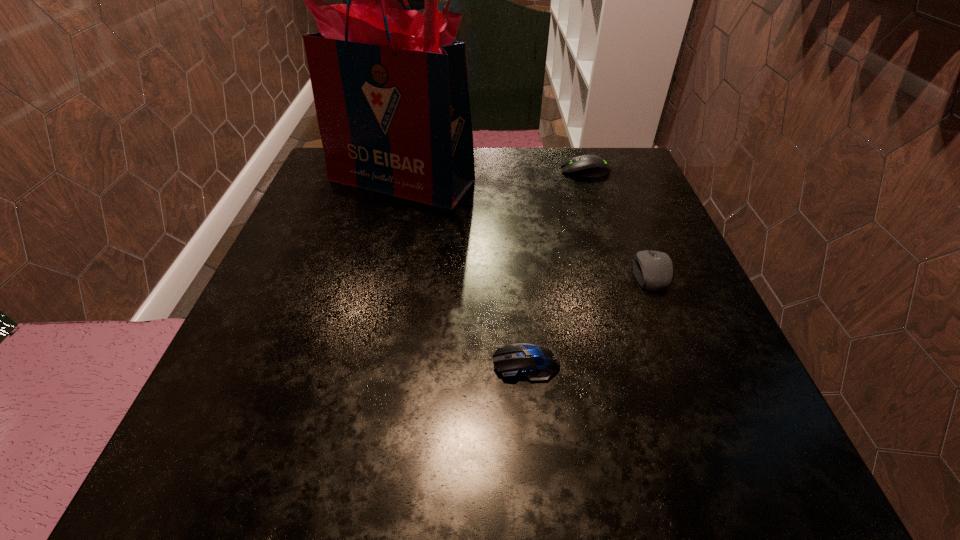
The height and width of the screenshot is (540, 960). In the image, there is a desktop. Identify the location of vacant space at the near edge. (518, 457).

The height and width of the screenshot is (540, 960). What are the coordinates of `vacant area at the left edge of the desktop` in the screenshot? It's located at (310, 362).

You are a GUI agent. You are given a task and a screenshot of the screen. Output one action in this format:
    pyautogui.click(x=<x>, y=<y>)
    Task: Click on the vacant space at the right edge of the desktop
    
    Given the screenshot: What is the action you would take?
    pyautogui.click(x=608, y=253)

Where is `free space at the far left corner of the desktop`? Image resolution: width=960 pixels, height=540 pixels. free space at the far left corner of the desktop is located at coordinates (327, 193).

Image resolution: width=960 pixels, height=540 pixels. I want to click on free space at the near right corner of the desktop, so click(712, 488).

You are a GUI agent. You are given a task and a screenshot of the screen. Output one action in this format:
    pyautogui.click(x=<x>, y=<y>)
    Task: Click on the blank region between the farthest computer mouse and the nearest object
    The width and height of the screenshot is (960, 540).
    Given the screenshot: What is the action you would take?
    click(556, 267)

This screenshot has height=540, width=960. I want to click on free spot between the farthest computer mouse and the shortest object, so click(556, 267).

This screenshot has height=540, width=960. I want to click on vacant area that lies between the second nearest computer mouse and the leftmost object, so click(526, 226).

This screenshot has height=540, width=960. What are the coordinates of `unoccupied position between the second farthest computer mouse and the farthest computer mouse` in the screenshot? It's located at (618, 222).

Locate an element on the screen. empty space that is in between the second nearest object and the grocery bag is located at coordinates (526, 226).